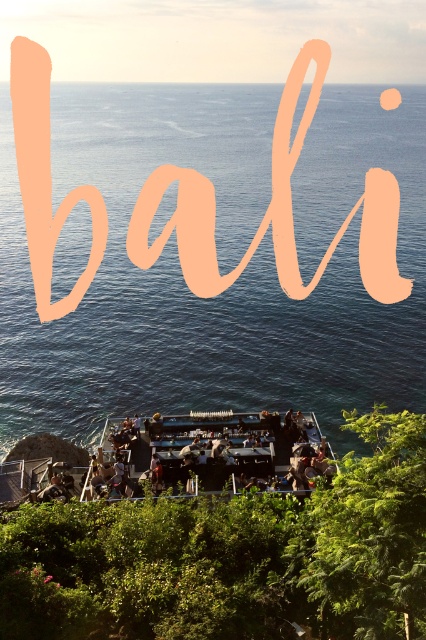
You are standing at the cliffside bar in Bali and want to know how far the point at coordinates [219,365] is from your current position. Can you determine the distance?

The point at coordinates [219,365] is 63.69 meters away from the viewer.